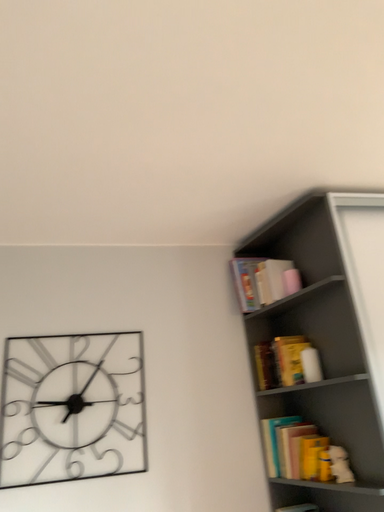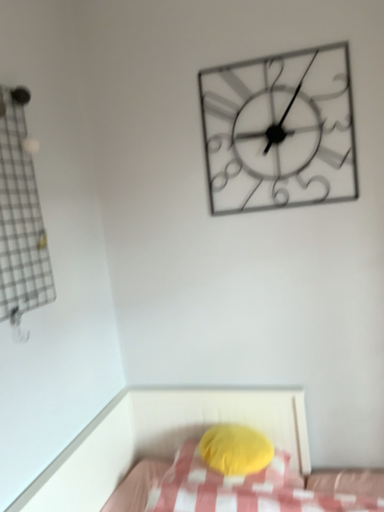
Question: Which way did the camera rotate in the video?

Choices:
 (A) rotated downward
 (B) rotated upward

Answer: (A)